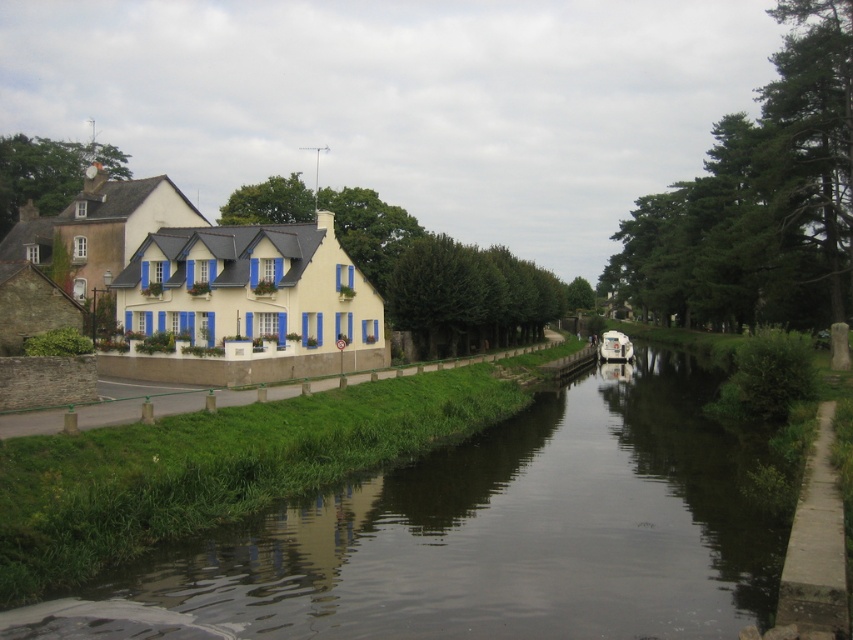
Question: Can you confirm if white painted wall at left is positioned below white glossy boat at center?

Choices:
 (A) no
 (B) yes

Answer: (B)

Question: In this image, where is smooth concrete canal at center located relative to white glossy boat at center?

Choices:
 (A) left
 (B) right

Answer: (A)

Question: Can you confirm if white painted wall at left is thinner than white glossy boat at center?

Choices:
 (A) no
 (B) yes

Answer: (A)

Question: Which object appears farthest from the camera in this image?

Choices:
 (A) white painted wall at left
 (B) smooth concrete canal at center
 (C) white glossy boat at center

Answer: (C)

Question: Which is farther from the smooth concrete canal at center?

Choices:
 (A) white glossy boat at center
 (B) white painted wall at left

Answer: (A)

Question: Which of the following is the closest to the observer?

Choices:
 (A) pos(604,355)
 (B) pos(241,396)

Answer: (B)